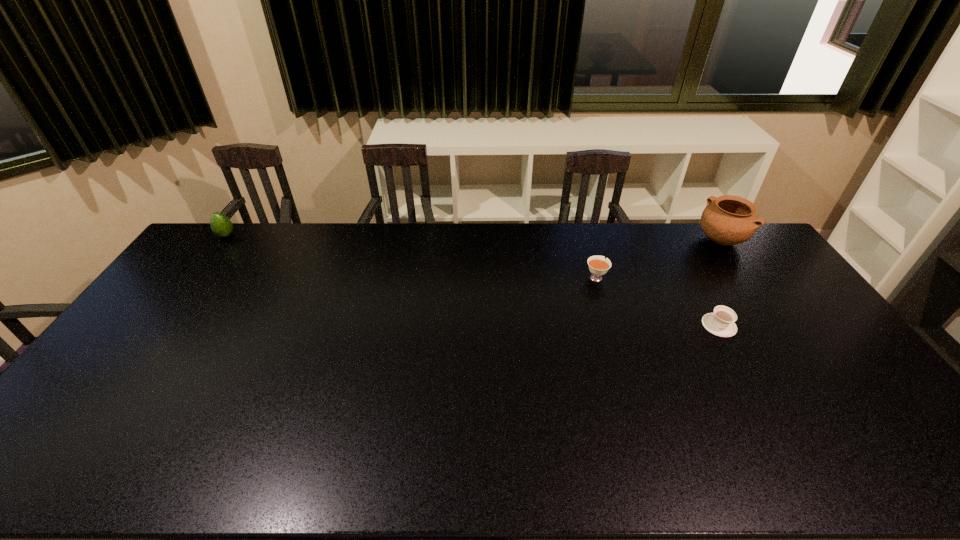
The width and height of the screenshot is (960, 540). In order to click on free space located 0.090m on the side of the left teacup with the handle in this screenshot , I will do `click(588, 253)`.

Locate an element on the screen. The width and height of the screenshot is (960, 540). vacant space positioned on the side of the left teacup with the handle is located at coordinates (588, 249).

Locate an element on the screen. vacant space situated 0.130m on the side of the left teacup with the handle is located at coordinates (587, 246).

Identify the location of free space located on the handle side of the shorter teacup. (690, 274).

Image resolution: width=960 pixels, height=540 pixels. What are the coordinates of `free space located 0.100m on the handle side of the shorter teacup` in the screenshot? It's located at (701, 292).

You are a GUI agent. You are given a task and a screenshot of the screen. Output one action in this format:
    pyautogui.click(x=<x>, y=<y>)
    Task: Click on the vacant region located on the handle side of the shorter teacup
    Image resolution: width=960 pixels, height=540 pixels.
    Given the screenshot: What is the action you would take?
    pyautogui.click(x=697, y=286)

The image size is (960, 540). Find the location of `pottery situated at the far edge`. pottery situated at the far edge is located at coordinates (727, 220).

At what (x,y) coordinates should I click in order to perform the action: click on avocado at the far edge. Please return your answer as a coordinate pair (x, y). Looking at the image, I should click on (221, 225).

At what (x,y) coordinates should I click in order to perform the action: click on object located at the left edge. Please return your answer as a coordinate pair (x, y). Looking at the image, I should click on (221, 225).

Image resolution: width=960 pixels, height=540 pixels. What are the coordinates of `object positioned at the right edge` in the screenshot? It's located at (727, 220).